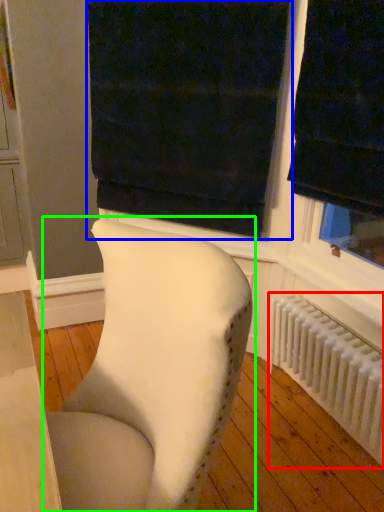
Question: Which object is positioned farthest from radiator (highlighted by a red box)? Select from curtain (highlighted by a blue box) and chair (highlighted by a green box).

Choices:
 (A) curtain
 (B) chair

Answer: (B)